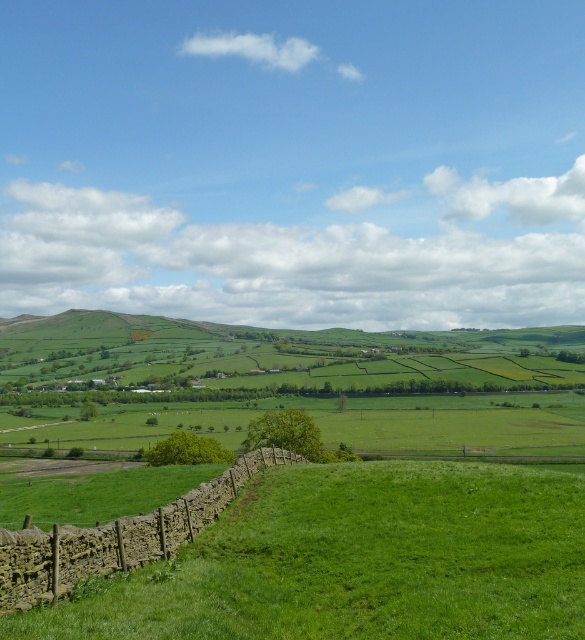
Question: Can you confirm if green grassy hillside at center is wider than stone wall at center?

Choices:
 (A) no
 (B) yes

Answer: (B)

Question: Considering the real-world distances, which object is closest to the green grassy hillside at center?

Choices:
 (A) green grassy at lower left
 (B) stone wall at center

Answer: (A)

Question: Which point appears closest to the camera in this image?

Choices:
 (A) (488, 588)
 (B) (481, 372)

Answer: (A)

Question: Is green grassy at lower left wider than green grassy hillside at center?

Choices:
 (A) yes
 (B) no

Answer: (B)

Question: Which object is farther from the camera taking this photo?

Choices:
 (A) stone wall at center
 (B) green grassy at lower left
 (C) green grassy hillside at center

Answer: (C)

Question: Can you confirm if green grassy at lower left is positioned to the left of stone wall at center?

Choices:
 (A) yes
 (B) no

Answer: (B)